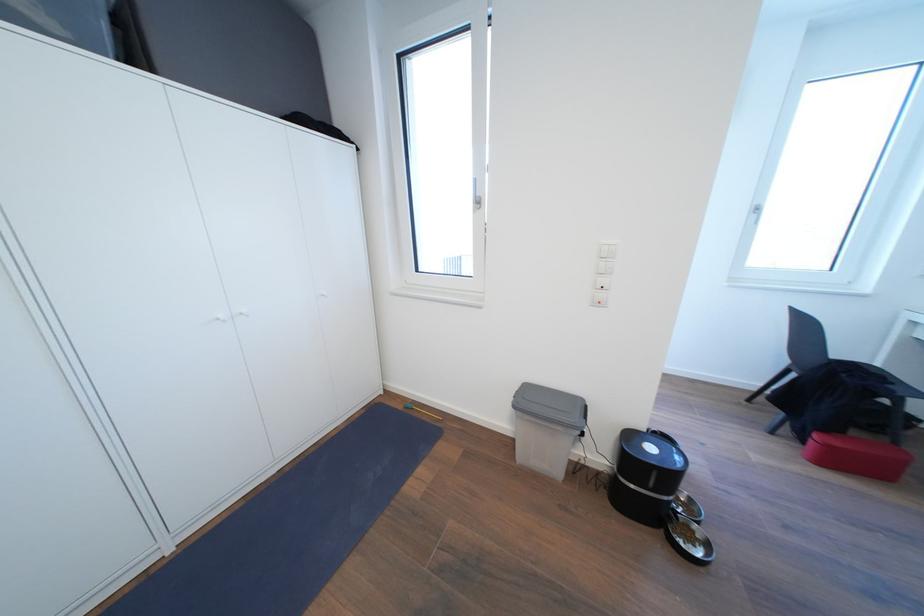
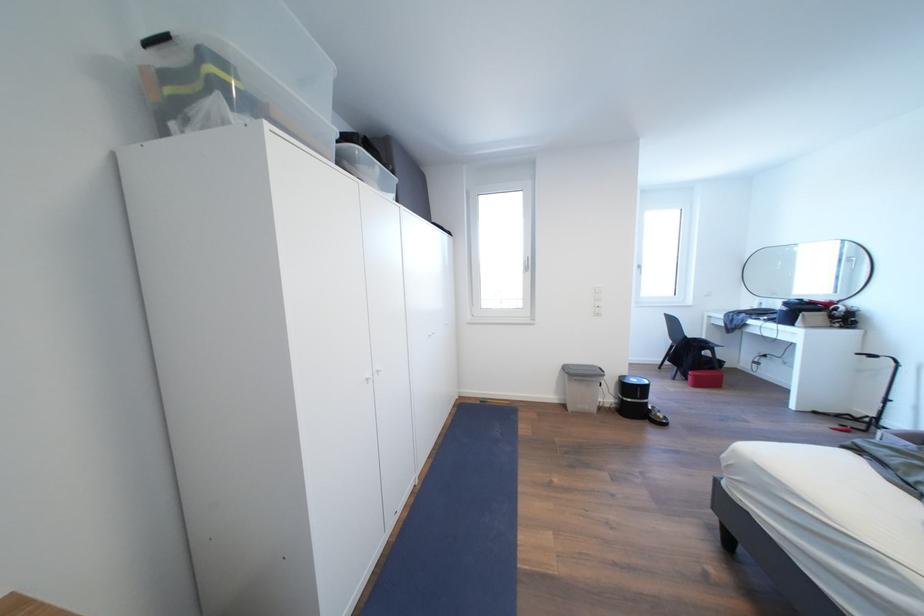
Where in the second image is the point corresponding to point (659, 453) from the first image?

(641, 386)